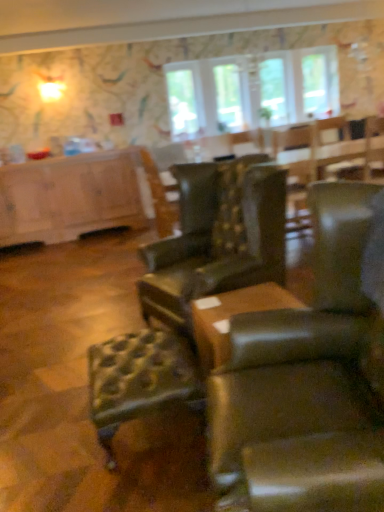
Question: From the image's perspective, is clear glass window at upper center, the 1th window in the left-to-right sequence, above or below leather tufted bar stool at center?

Choices:
 (A) below
 (B) above

Answer: (B)

Question: Which is correct: clear glass window at upper center, arranged as the 2th window when viewed from the right, is inside leather tufted bar stool at center, or outside of it?

Choices:
 (A) outside
 (B) inside

Answer: (A)

Question: Which object is the closest to the leather tufted bar stool at center?

Choices:
 (A) leather at center, the second chair from the back
 (B) clear glass window at upper center, arranged as the 2th window when viewed from the right
 (C) brown leather ottoman at center
 (D) leather armchair at center, arranged as the first chair when viewed from the back
 (E) white wood cabinet at left

Answer: (C)

Question: Considering the real-world distances, which object is farthest from the leather at center, which appears as the 1th chair when viewed from the front?

Choices:
 (A) clear glass window at upper center, which appears as the first window when viewed from the right
 (B) clear glass window at upper center, which appears as the first window screen when viewed from the left
 (C) white wood cabinet at left
 (D) clear glass window at upper center, which is the 1th window screen from right to left
 (E) leather tufted bar stool at center

Answer: (B)